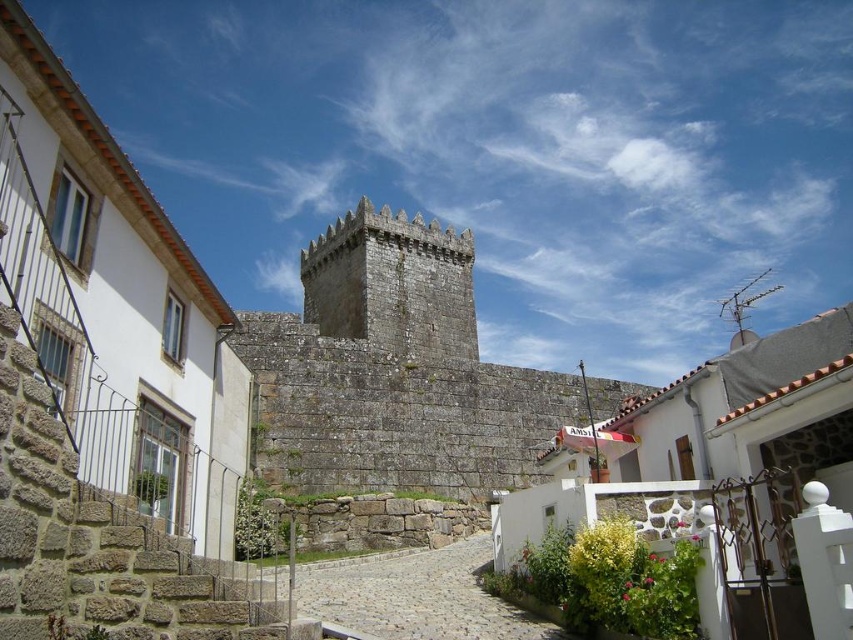
Question: Is rustic stone castle at center above cobblestone alley at center?

Choices:
 (A) yes
 (B) no

Answer: (A)

Question: Observing the image, what is the correct spatial positioning of rustic stone castle at center in reference to cobblestone alley at center?

Choices:
 (A) left
 (B) right

Answer: (A)

Question: Which point is farther to the camera?

Choices:
 (A) (392, 467)
 (B) (473, 595)

Answer: (A)

Question: Which point is farther to the camera?

Choices:
 (A) tap(450, 550)
 (B) tap(346, 240)

Answer: (B)

Question: Which point is closer to the camera taking this photo?

Choices:
 (A) (477, 372)
 (B) (395, 572)

Answer: (B)

Question: Considering the relative positions of rustic stone castle at center and cobblestone alley at center in the image provided, where is rustic stone castle at center located with respect to cobblestone alley at center?

Choices:
 (A) below
 (B) above

Answer: (B)